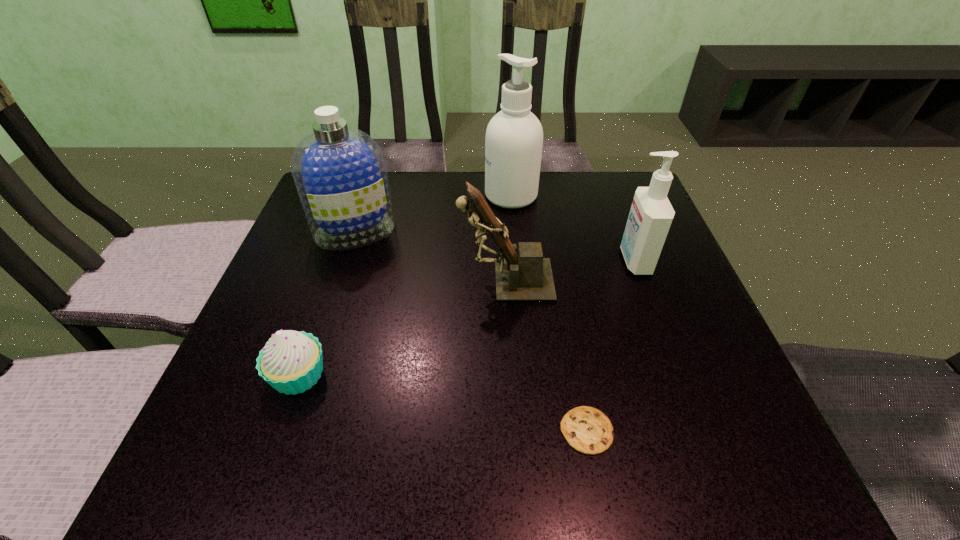
This screenshot has height=540, width=960. I want to click on vacant space located on the front label of the farthest object, so click(x=386, y=195).

Locate an element on the screen. The height and width of the screenshot is (540, 960). vacant area situated on the front label of the farthest object is located at coordinates (332, 195).

I want to click on free spot located on the front of the leftmost cleansing agent, so click(x=322, y=332).

In order to click on free space located 0.270m on the front label of the rightmost object in this screenshot , I will do `click(497, 261)`.

This screenshot has width=960, height=540. I want to click on vacant space located on the front label of the rightmost object, so click(507, 261).

Image resolution: width=960 pixels, height=540 pixels. Find the location of `vacant space located on the front label of the rightmost object`. vacant space located on the front label of the rightmost object is located at coordinates (565, 261).

Where is `vacant space located 0.180m on the front-facing side of the figurine`? The height and width of the screenshot is (540, 960). vacant space located 0.180m on the front-facing side of the figurine is located at coordinates [373, 280].

This screenshot has height=540, width=960. I want to click on vacant space located on the front-facing side of the figurine, so click(x=364, y=280).

The width and height of the screenshot is (960, 540). Identify the location of free space located on the front-facing side of the figurine. (275, 280).

Locate an element on the screen. This screenshot has width=960, height=540. free spot located on the right of the fifth tallest object is located at coordinates (386, 375).